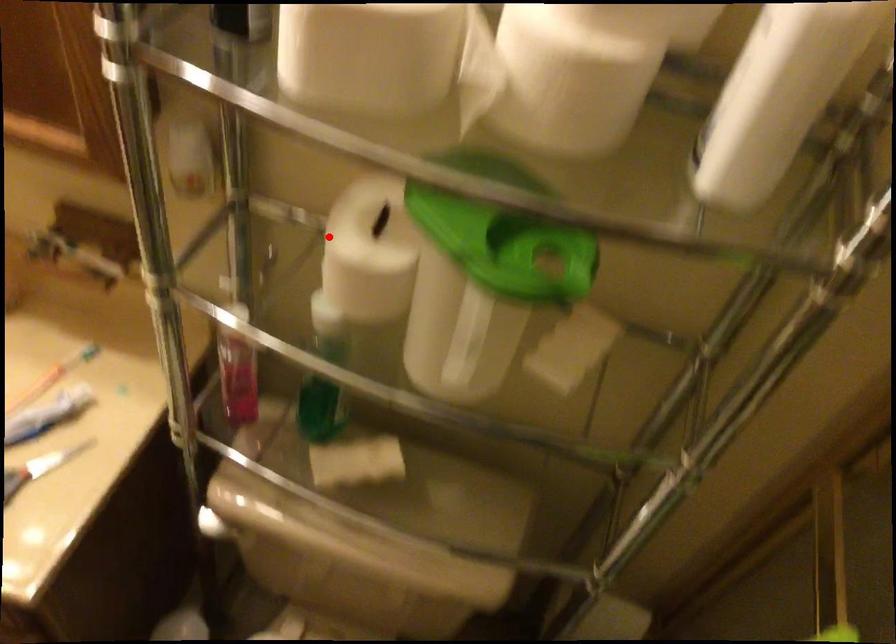
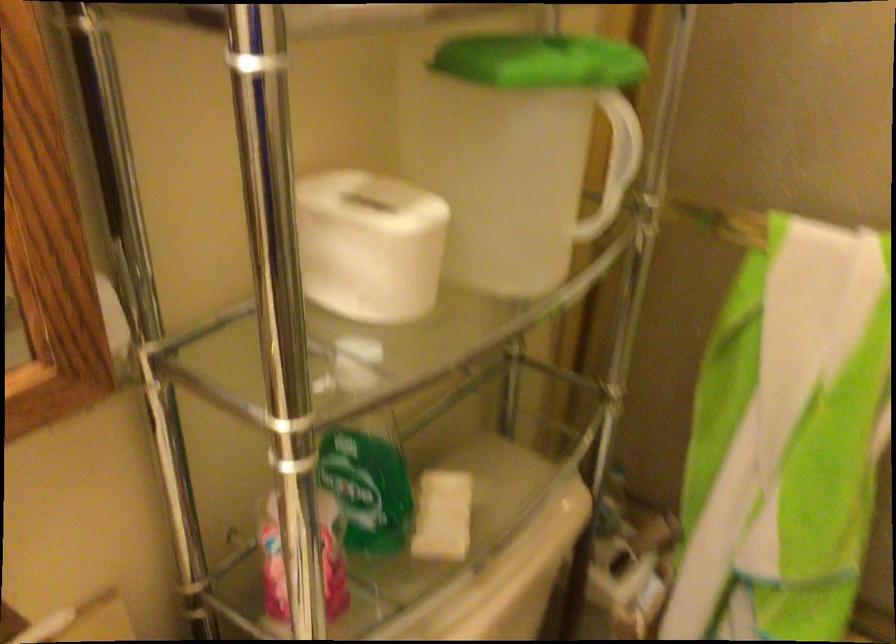
Question: I am providing you with two images of the same scene from different viewpoints. Image1 has a red point marked. In image2, the corresponding 3D location appears at what relative position? Reply with the corresponding letter.

Choices:
 (A) Closer
 (B) Farther

Answer: (A)